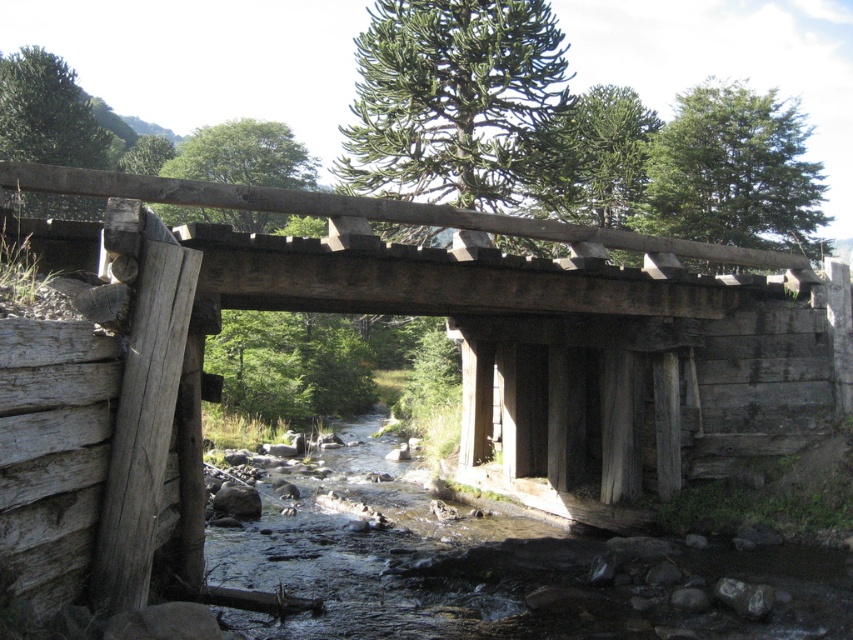
Question: Is weathered wood bridge at center positioned behind clear water at center?

Choices:
 (A) no
 (B) yes

Answer: (A)

Question: Can you confirm if weathered wood bridge at center is thinner than clear water at center?

Choices:
 (A) no
 (B) yes

Answer: (B)

Question: Which point is closer to the camera?

Choices:
 (A) weathered wood bridge at center
 (B) clear water at center

Answer: (A)

Question: Which object is farther from the camera taking this photo?

Choices:
 (A) weathered wood bridge at center
 (B) clear water at center

Answer: (B)

Question: Does weathered wood bridge at center come behind clear water at center?

Choices:
 (A) yes
 (B) no

Answer: (B)